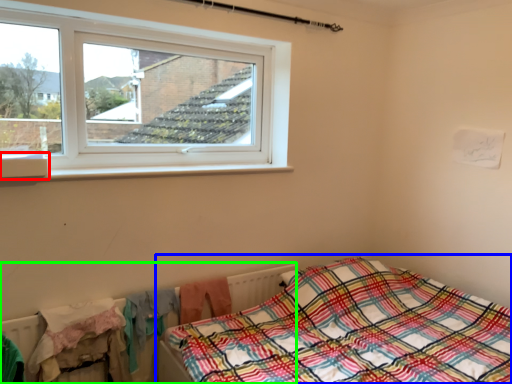
Question: Considering the real-world distances, which object is closest to window sill (highlighted by a red box)? bed (highlighted by a blue box) or radiator (highlighted by a green box).

Choices:
 (A) bed
 (B) radiator

Answer: (B)